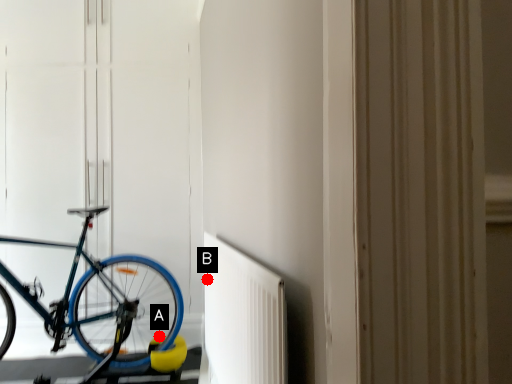
Question: Two points are circled on the image, labeled by A and B beside each circle. Which point appears closest to the camera in this image?

Choices:
 (A) A is closer
 (B) B is closer

Answer: (B)